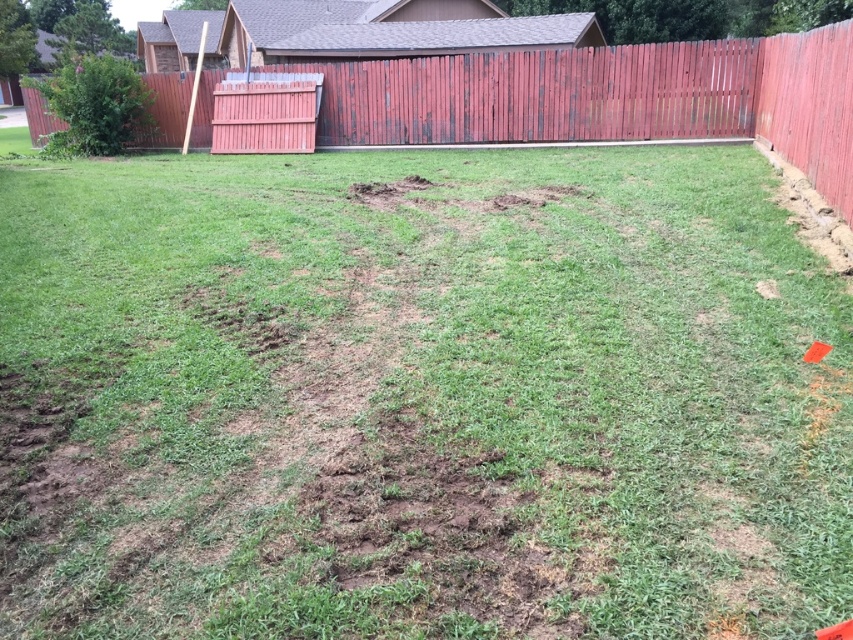
You are designing a garden layout and need to place a new bench between the weathered wood fence at upper center and the green leafy bush at upper left. Based on their sizes, which object should you place the bench closer to for better balance?

The bench should be placed closer to the green leafy bush at upper left because the weathered wood fence at upper center is wider, so positioning the bench nearer to the smaller bush helps balance the composition.

You are standing in the backyard and want to place a small potted plant exactly at the point marked as point (612,97). Given the scene description, what surface will the potted plant be placed on?

The point (612,97) is on the weathered wood fence at upper center, so the potted plant will be placed on the weathered wood fence at upper center.

You are a gardener planning to plant a new flower bed. You see the weathered wood fence at upper center and the green leafy bush at upper left. Which object is closer to the ground?

The weathered wood fence at upper center is closer to the ground because it is below the green leafy bush at upper left.